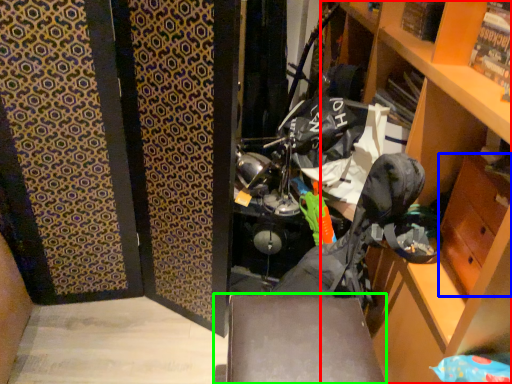
Question: Estimate the real-world distances between objects in this image. Which object is farther from cabinetry (highlighted by a red box), drawer (highlighted by a blue box) or furniture (highlighted by a green box)?

Choices:
 (A) drawer
 (B) furniture

Answer: (B)